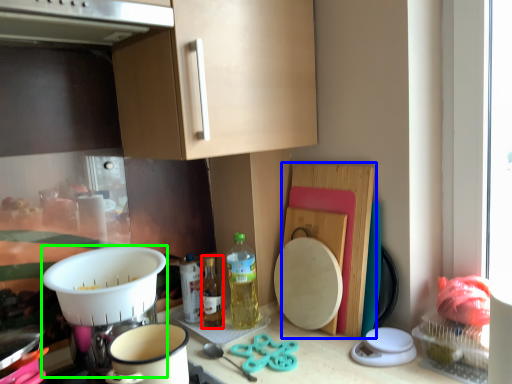
Question: Estimate the real-world distances between objects in this image. Which object is farther from bottle (highlighted by a red box), cutting board (highlighted by a blue box) or appliance (highlighted by a green box)?

Choices:
 (A) cutting board
 (B) appliance

Answer: (A)